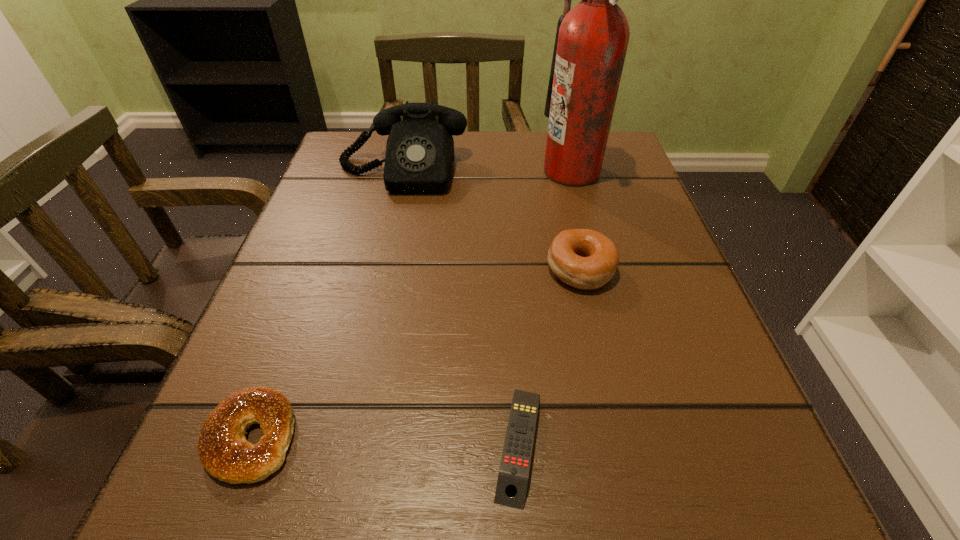
Identify the location of empty location between the tallest object and the second tallest object. The image size is (960, 540). (x=487, y=172).

You are a GUI agent. You are given a task and a screenshot of the screen. Output one action in this format:
    pyautogui.click(x=<x>, y=<y>)
    Task: Click on the object that is the fourth closest to the right bagel
    This screenshot has width=960, height=540.
    Given the screenshot: What is the action you would take?
    tap(223, 450)

Identify the location of the third closest object to the third farthest object. Image resolution: width=960 pixels, height=540 pixels. point(419,158).

The height and width of the screenshot is (540, 960). Identify the location of free location that satisfies the following two spatial constraints: 1. on the front of the tallest object near the operation label; 2. on the dial of the telephone. (571, 172).